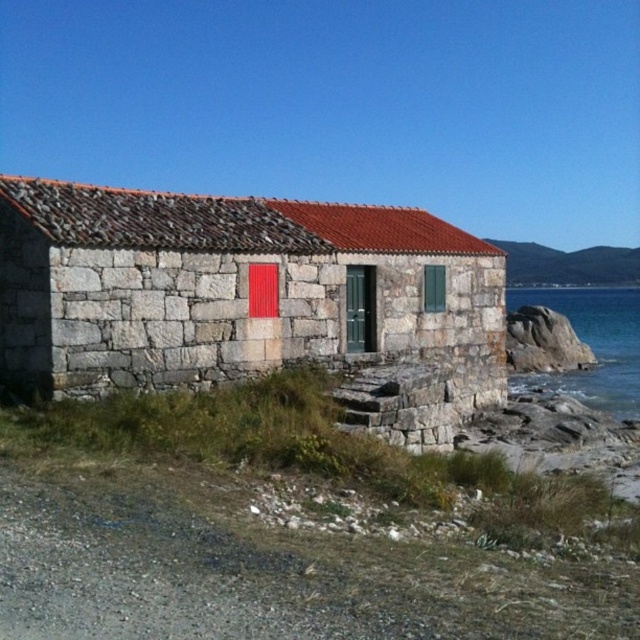
Question: Can you confirm if stone textured hut at center is positioned above blue water at lower right?

Choices:
 (A) yes
 (B) no

Answer: (B)

Question: Which point appears farthest from the camera in this image?

Choices:
 (A) (627, 353)
 (B) (397, 205)

Answer: (B)

Question: Is stone textured hut at center bigger than blue water at lower right?

Choices:
 (A) yes
 (B) no

Answer: (B)

Question: Does stone textured hut at center have a smaller size compared to blue water at lower right?

Choices:
 (A) yes
 (B) no

Answer: (A)